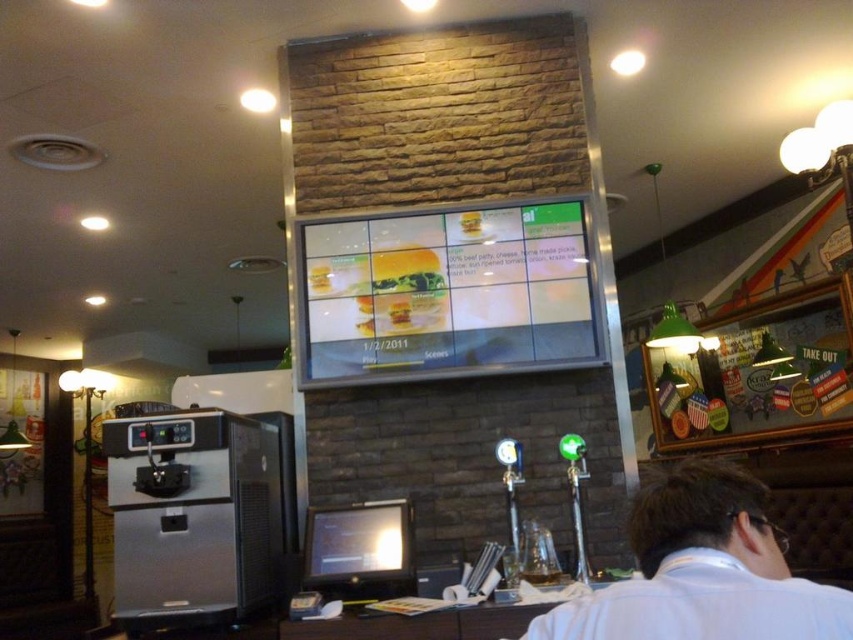
Question: Based on their relative distances, which object is farther from the golden crispy chicken at center?

Choices:
 (A) white shirt at lower right
 (B) matte yellow cheeseburger at center

Answer: (A)

Question: Which is nearer to the white shirt at lower right?

Choices:
 (A) golden crispy chicken at center
 (B) matte yellow cheeseburger at center

Answer: (B)

Question: Can you confirm if white shirt at lower right is bigger than golden crispy chicken at center?

Choices:
 (A) yes
 (B) no

Answer: (A)

Question: Does matte yellow cheeseburger at center have a lesser width compared to golden crispy chicken at center?

Choices:
 (A) yes
 (B) no

Answer: (B)

Question: Where is matte yellow cheeseburger at center located in relation to golden crispy chicken at center in the image?

Choices:
 (A) left
 (B) right

Answer: (B)

Question: Which object is positioned farthest from the golden crispy chicken at center?

Choices:
 (A) matte yellow cheeseburger at center
 (B) white shirt at lower right

Answer: (B)